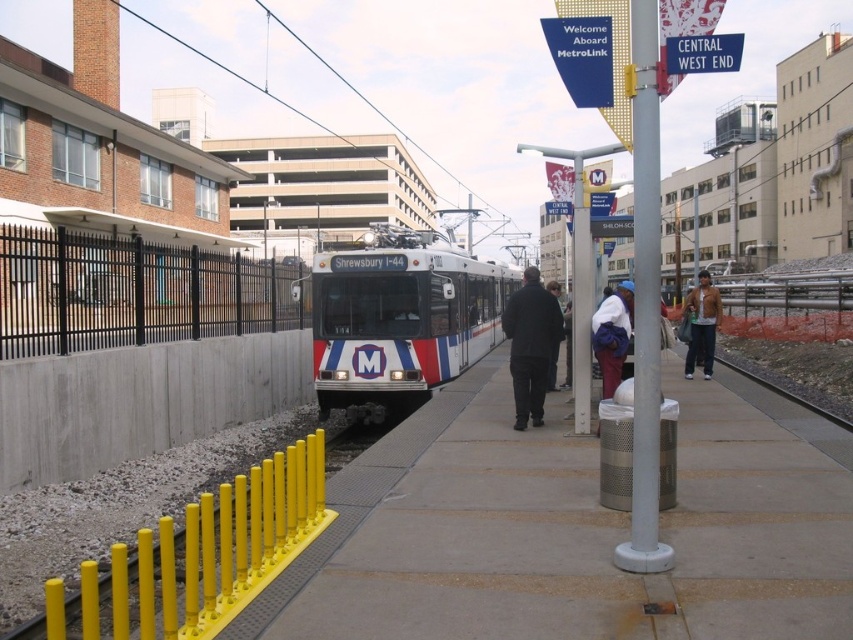
Measure the distance between black matte jacket at center and leather jacket at right.

15.27 feet

Does black matte jacket at center have a smaller size compared to leather jacket at right?

No, black matte jacket at center is not smaller than leather jacket at right.

Is point (549, 371) less distant than point (688, 300)?

Yes, point (549, 371) is in front of point (688, 300).

Locate an element on the screen. The height and width of the screenshot is (640, 853). black matte jacket at center is located at coordinates (531, 346).

Does silver metallic pole at center lie in front of black matte jacket at center?

Yes, it is in front of black matte jacket at center.

Which is behind, point (641, 298) or point (543, 298)?

Point (543, 298)

This screenshot has width=853, height=640. In order to click on silver metallic pole at center in this screenshot , I will do `click(645, 300)`.

Does silver metallic pole at center appear over leather jacket at right?

No, silver metallic pole at center is not above leather jacket at right.

Is point (653, 273) more distant than point (694, 340)?

That is False.

This screenshot has height=640, width=853. Find the location of `silver metallic pole at center`. silver metallic pole at center is located at coordinates (645, 300).